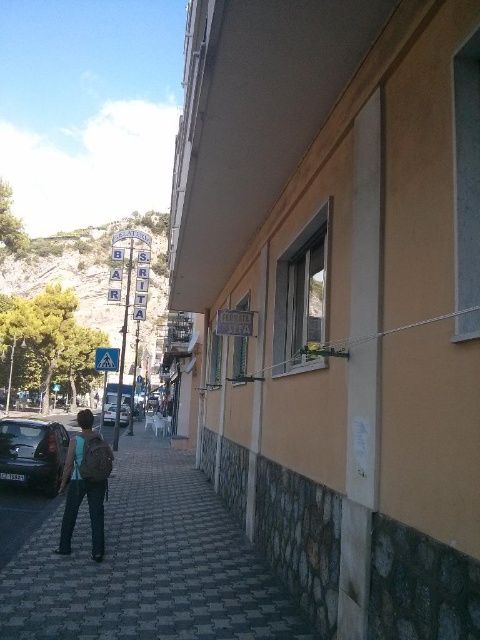
You are standing on the sidewalk and notice the dark gray paving stone at lower left and the silver metallic van at center. Which object is positioned more to the right from your perspective?

The dark gray paving stone at lower left is to the right of the silver metallic van at center, so it is positioned more to the right from your perspective.

From the picture: You are standing on the sidewalk and want to walk to the silver metallic van at center. Is the dark gray paving stone at lower left blocking your path?

The dark gray paving stone at lower left is in front of the silver metallic van at center, so it is blocking the path to the van.

You are a delivery person who needs to park your 1.8 meters tall delivery box in this street scene. Looking at the shiny black car at lower left and the silver metallic van at center, which vehicle has enough vertical space for your box?

The silver metallic van at center has greater height than the shiny black car at lower left, so the delivery box can be placed near the silver metallic van at center as it provides sufficient vertical clearance.